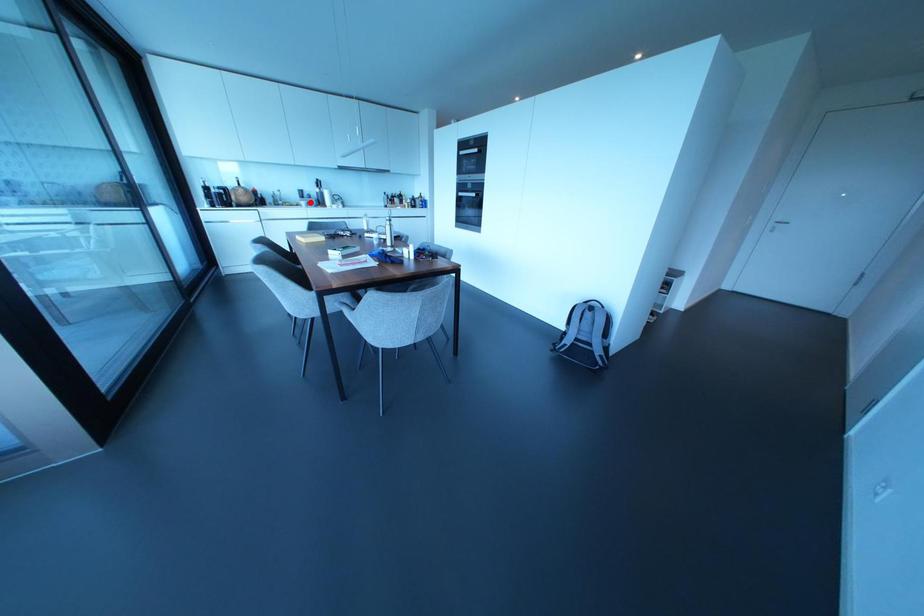
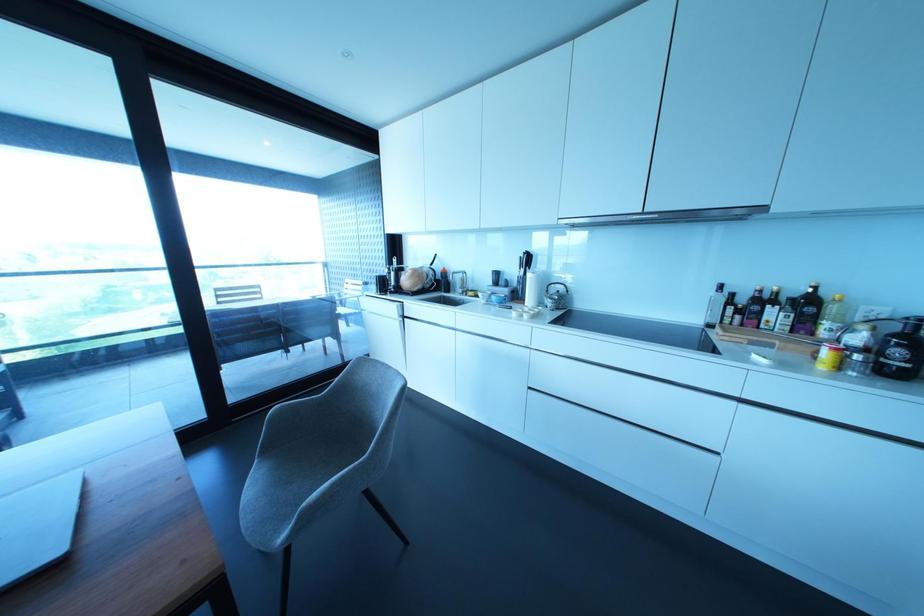
Question: I am providing you with two images of the same scene from different viewpoints. A red point is shown in image1. For the corresponding object point in image2, is it positioned nearer or farther from the camera?

Choices:
 (A) Nearer
 (B) Farther

Answer: (B)